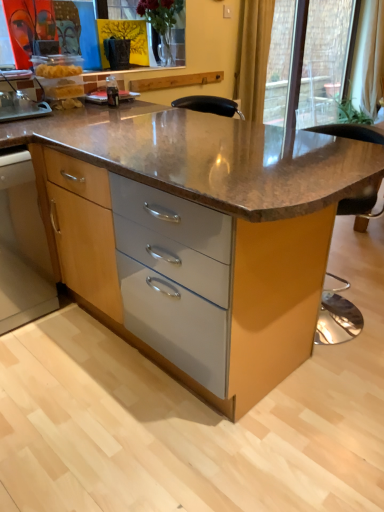
Question: Visually, is brown polished granite table at center positioned to the left or to the right of yellow fabric curtain at upper right?

Choices:
 (A) right
 (B) left

Answer: (B)

Question: Is brown polished granite table at center taller or shorter than yellow fabric curtain at upper right?

Choices:
 (A) short
 (B) tall

Answer: (A)

Question: Based on their relative distances, which object is farther from the brown polished granite table at center?

Choices:
 (A) transparent glass door at upper right
 (B) wooden cabinet at lower left
 (C) yellow fabric curtain at upper right

Answer: (A)

Question: Which object is positioned farthest from the transparent glass door at upper right?

Choices:
 (A) brown polished granite table at center
 (B) wooden cabinet at lower left
 (C) yellow fabric curtain at upper right

Answer: (B)